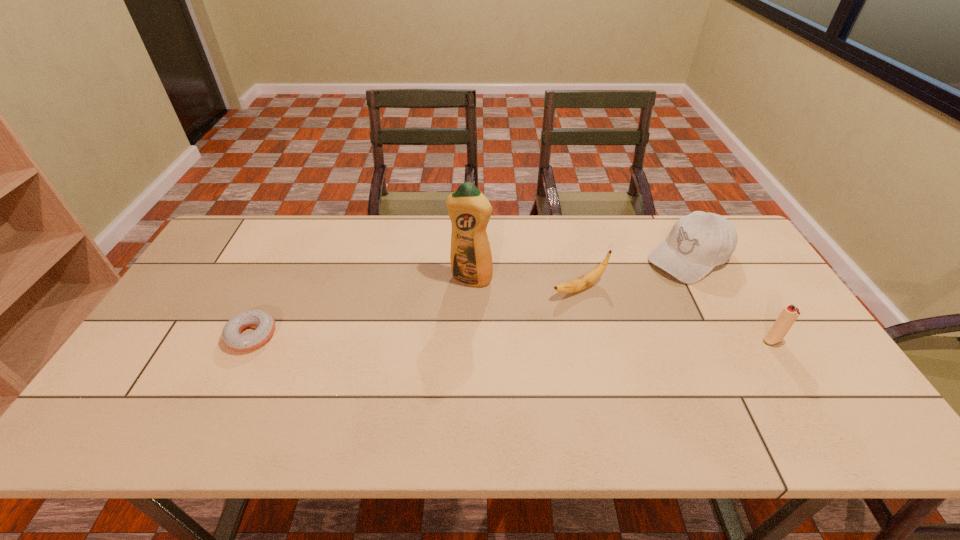
The image size is (960, 540). In order to click on vacant point located on the label of the detergent in this screenshot , I will do click(436, 347).

The height and width of the screenshot is (540, 960). Find the location of `vacant space located 0.390m on the label of the detergent`. vacant space located 0.390m on the label of the detergent is located at coordinates (411, 399).

This screenshot has width=960, height=540. I want to click on free space located 0.150m on the label of the detergent, so click(446, 325).

I want to click on free space located on the peel of the third object from left to right from the top, so click(x=468, y=334).

The height and width of the screenshot is (540, 960). I want to click on vacant space located 0.230m on the peel of the third object from left to right from the top, so click(488, 326).

The height and width of the screenshot is (540, 960). Find the location of `vacant point located 0.070m on the peel of the third object from left to right from the top`. vacant point located 0.070m on the peel of the third object from left to right from the top is located at coordinates (536, 304).

The width and height of the screenshot is (960, 540). Find the location of `free spot located on the front-facing side of the baseball cap`. free spot located on the front-facing side of the baseball cap is located at coordinates (571, 332).

Image resolution: width=960 pixels, height=540 pixels. Identify the location of vacant position located on the front-facing side of the baseball cap. (645, 284).

This screenshot has height=540, width=960. Find the location of `vacant region located on the front-facing side of the baseball cap`. vacant region located on the front-facing side of the baseball cap is located at coordinates (612, 306).

The width and height of the screenshot is (960, 540). In order to click on object located at the far edge in this screenshot , I will do `click(698, 242)`.